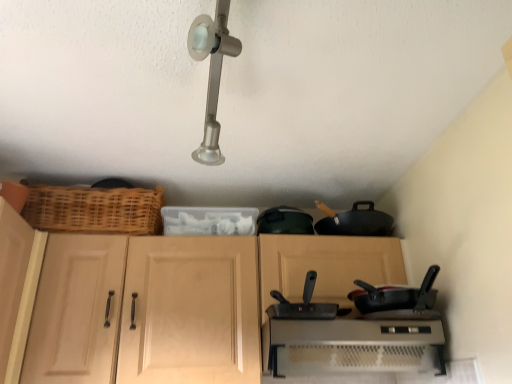
Locate an element on the screen. woven wood basket at left is located at coordinates [94, 209].

Find the location of `black matte frying pan at right`. black matte frying pan at right is located at coordinates (397, 300).

Where is `wooden cabinet at center`? The width and height of the screenshot is (512, 384). wooden cabinet at center is located at coordinates (219, 310).

This screenshot has width=512, height=384. Describe the element at coordinates (302, 304) in the screenshot. I see `black matte wok at center` at that location.

Find the location of `woven wood basket at left`. woven wood basket at left is located at coordinates (94, 209).

Which point is more distant from viewer, (27, 292) or (377, 370)?

Positioned behind is point (27, 292).

Which of these two, light wood cabinet at left or metallic silver toaster at lower center, is thinner?

With smaller width is light wood cabinet at left.

Is light wood cabinet at left turned away from metallic silver toaster at lower center?

No.

Considering the relative sizes of wooden cabinet at center and black matte frying pan at right in the image provided, is wooden cabinet at center wider than black matte frying pan at right?

Yes.

From a real-world perspective, which object stands above the other?

From a 3D spatial view, wooden cabinet at center is above.

Are wooden cabinet at center and black matte frying pan at right making contact?

No.

From the image's perspective, which is above, wooden cabinet at center or black matte frying pan at right?

black matte frying pan at right, from the image's perspective.

How many degrees apart are the facing directions of black matte wok at center and wooden cabinet at center?

7.04 degrees separate the facing orientations of black matte wok at center and wooden cabinet at center.

Is wooden cabinet at center located within black matte wok at center?

A: Definitely not — wooden cabinet at center is not inside black matte wok at center.

Is black matte wok at center facing away from wooden cabinet at center?

Correct, black matte wok at center is looking away from wooden cabinet at center.

In the scene shown: From the image's perspective, between black matte wok at center and wooden cabinet at center, who is located below?

wooden cabinet at center, from the image's perspective.

Can you confirm if wooden cabinet at center is thinner than light wood cabinet at left?

No, wooden cabinet at center is not thinner than light wood cabinet at left.

This screenshot has height=384, width=512. Find the location of `dresser that appears below the light wood cabinet at left (from a real-world perspective)`. dresser that appears below the light wood cabinet at left (from a real-world perspective) is located at coordinates (219, 310).

Could you tell me if wooden cabinet at center is facing light wood cabinet at left?

Yes, wooden cabinet at center is turned towards light wood cabinet at left.

Is wooden cabinet at center not close to black matte wok at center?

They are positioned close to each other.

Can you confirm if wooden cabinet at center is bigger than black matte wok at center?

Correct, wooden cabinet at center is larger in size than black matte wok at center.

Which object is thinner, wooden cabinet at center or black matte wok at center?

black matte wok at center is thinner.

Considering the points (333, 345) and (303, 315), which point is in front, point (333, 345) or point (303, 315)?

Positioned in front is point (303, 315).

Does wooden cabinet at center touch woven wood basket at left?

No, wooden cabinet at center is not with woven wood basket at left.

In the scene shown: Can you confirm if wooden cabinet at center is positioned to the right of woven wood basket at left?

Indeed, wooden cabinet at center is positioned on the right side of woven wood basket at left.

Which of these two, wooden cabinet at center or woven wood basket at left, is thinner?

woven wood basket at left.

Find the location of a particular element. basket above the wooden cabinet at center (from a real-world perspective) is located at coordinates (94, 209).

Which object is further away from the camera taking this photo, black matte wok at center or light wood cabinet at left?

black matte wok at center is more distant.

Does black matte wok at center have a smaller size compared to light wood cabinet at left?

Yes.

Which is more to the right, black matte wok at center or light wood cabinet at left?

From the viewer's perspective, black matte wok at center appears more on the right side.

Is black matte wok at center inside or outside of light wood cabinet at left?

black matte wok at center lies outside light wood cabinet at left.

Locate an element on the screen. home appliance below the light wood cabinet at left (from the image's perspective) is located at coordinates (354, 346).

Where is `frying pan on the right of wooden cabinet at center`? frying pan on the right of wooden cabinet at center is located at coordinates (397, 300).

Which object lies nearer to the anchor point black matte wok at center, metallic silver toaster at lower center or wooden cabinet at center?

metallic silver toaster at lower center lies closer to black matte wok at center than the other object.

When comparing their distances from woven wood basket at left, does wooden cabinet at center or metallic silver toaster at lower center seem closer?

wooden cabinet at center.

When comparing their distances from woven wood basket at left, does wooden cabinet at center or black matte frying pan at right seem further?

Among the two, black matte frying pan at right is located further to woven wood basket at left.

From the image, which object appears to be farther from metallic silver toaster at lower center, wooden cabinet at center or black matte wok at center?

wooden cabinet at center.

Based on their spatial positions, is metallic silver toaster at lower center or black matte wok at center closer to black matte frying pan at right?

metallic silver toaster at lower center.

Considering their positions, is black matte wok at center positioned closer to wooden cabinet at center than metallic silver toaster at lower center?

The object closer to wooden cabinet at center is metallic silver toaster at lower center.

When comparing their distances from black matte wok at center, does metallic silver toaster at lower center or light wood cabinet at left seem further?

light wood cabinet at left is positioned further to the anchor black matte wok at center.

Considering their positions, is black matte frying pan at right positioned further to metallic silver toaster at lower center than light wood cabinet at left?

light wood cabinet at left lies further to metallic silver toaster at lower center than the other object.

In order to click on dresser located between light wood cabinet at left and black matte wok at center in the left-right direction in this screenshot , I will do click(219, 310).

Locate an element on the screen. dresser between light wood cabinet at left and black matte frying pan at right from left to right is located at coordinates (219, 310).

Where is `dresser situated between woven wood basket at left and black matte wok at center from left to right`? This screenshot has width=512, height=384. dresser situated between woven wood basket at left and black matte wok at center from left to right is located at coordinates (219, 310).

This screenshot has width=512, height=384. I want to click on basket between light wood cabinet at left and black matte wok at center from left to right, so point(94,209).